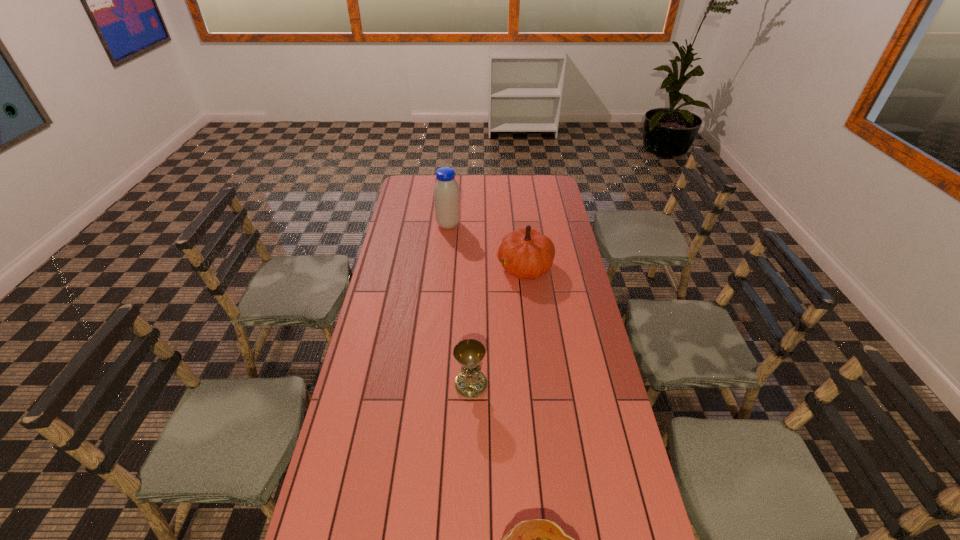
Locate an element on the screen. The width and height of the screenshot is (960, 540). the leftmost object is located at coordinates (446, 190).

Identify the location of the tallest object. Image resolution: width=960 pixels, height=540 pixels. (446, 190).

Locate an element on the screen. The image size is (960, 540). the second farthest object is located at coordinates [527, 254].

You are a GUI agent. You are given a task and a screenshot of the screen. Output one action in this format:
    pyautogui.click(x=<x>, y=<y>)
    Task: Click on the third shortest object
    
    Given the screenshot: What is the action you would take?
    pyautogui.click(x=527, y=254)

Find the location of a particular element. The image size is (960, 540). the third tallest object is located at coordinates (470, 383).

Locate an element on the screen. the third object from right to left is located at coordinates (470, 383).

Locate an element on the screen. This screenshot has height=540, width=960. vacant space positioned on the back of the farthest object is located at coordinates (453, 179).

Locate an element on the screen. The image size is (960, 540). vacant position located on the front-facing side of the pumpkin is located at coordinates (467, 267).

Locate an element on the screen. vacant space located on the front-facing side of the pumpkin is located at coordinates (411, 267).

The height and width of the screenshot is (540, 960). Find the location of `vacant area situated on the front-facing side of the pumpkin`. vacant area situated on the front-facing side of the pumpkin is located at coordinates (420, 267).